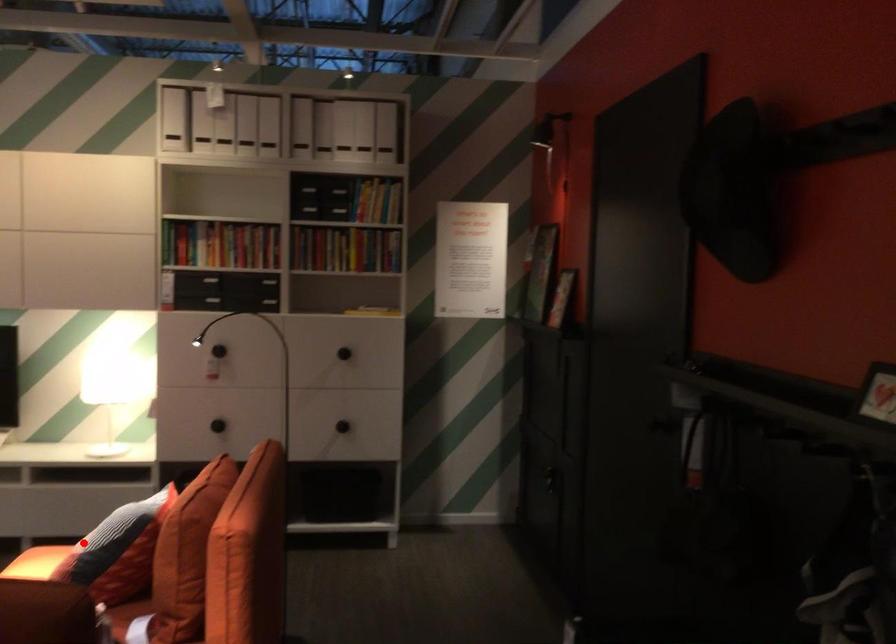
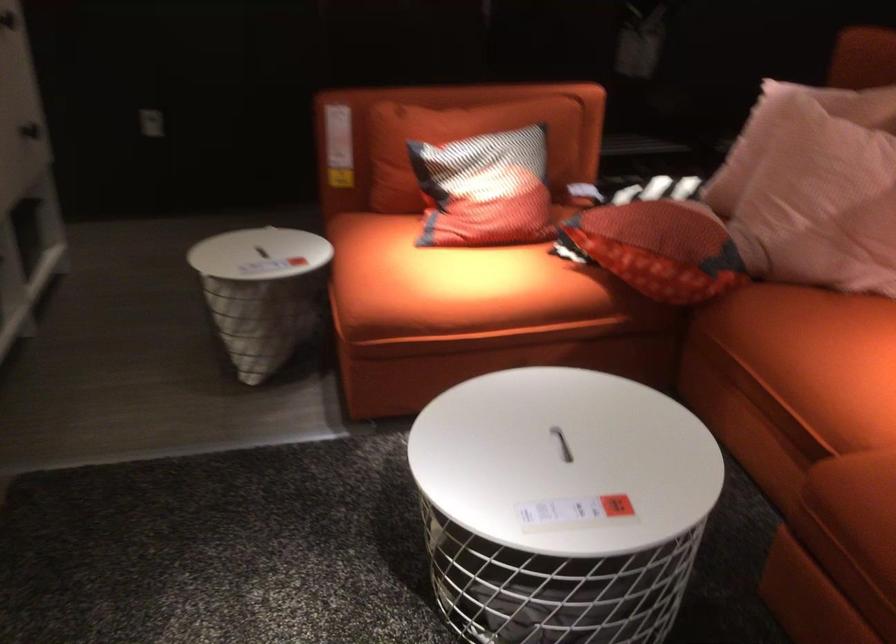
Locate, in the second image, the point that corresponds to the highlighted location in the first image.

(485, 190)